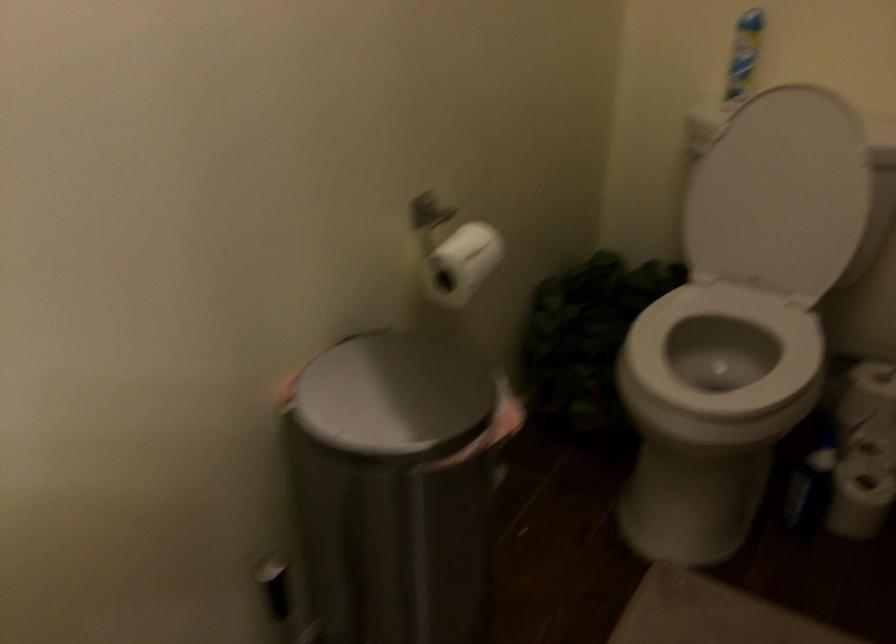
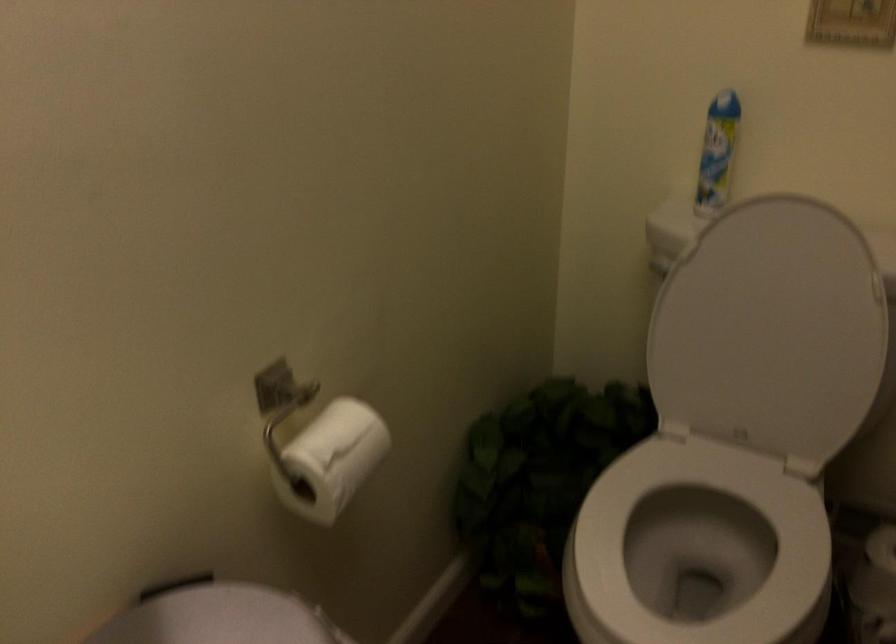
Find the pixel in the second image that matches (x=781, y=194) in the first image.

(771, 330)